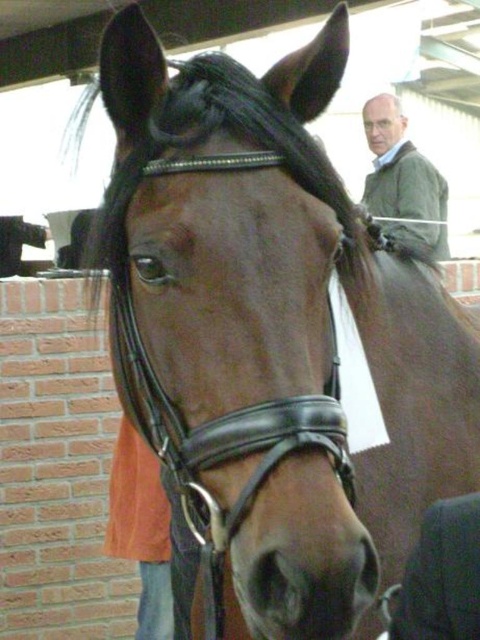
Question: Which point appears farthest from the camera in this image?

Choices:
 (A) (369, 100)
 (B) (381, 170)

Answer: (A)

Question: Among these points, which one is farthest from the camera?

Choices:
 (A) (388, 138)
 (B) (433, 220)

Answer: (A)

Question: Can you confirm if green matte jacket at upper right is wider than white hair at upper center?

Choices:
 (A) no
 (B) yes

Answer: (B)

Question: Is green matte jacket at upper right positioned before white hair at upper center?

Choices:
 (A) no
 (B) yes

Answer: (B)

Question: Can you confirm if green matte jacket at upper right is positioned above white hair at upper center?

Choices:
 (A) no
 (B) yes

Answer: (A)